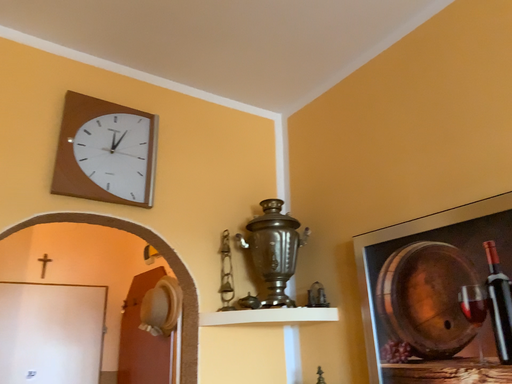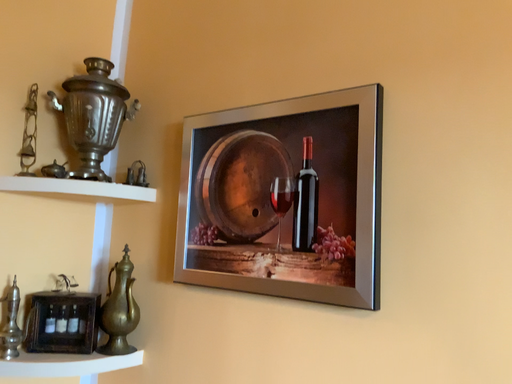
Question: How did the camera likely rotate when shooting the video?

Choices:
 (A) rotated downward
 (B) rotated upward

Answer: (A)